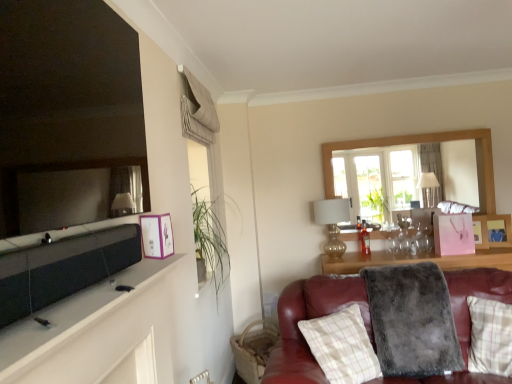
Describe the element at coordinates (253, 350) in the screenshot. I see `brown woven basket at lower right` at that location.

Measure the distance between purple paper picture frame at upper left, which appears as the first picture frame when viewed from the left, and camera.

purple paper picture frame at upper left, which appears as the first picture frame when viewed from the left, is 1.58 meters away from camera.

What is the approximate width of gray fluffy blanket at lower right?

28.97 inches.

Describe the element at coordinates (425, 142) in the screenshot. I see `wooden frame window at upper right` at that location.

Image resolution: width=512 pixels, height=384 pixels. What are the coordinates of `brown woven basket at lower right` in the screenshot? It's located at 253,350.

Considering the sizes of matte black tv at upper left and gray fluffy blanket at lower right in the image, is matte black tv at upper left bigger or smaller than gray fluffy blanket at lower right?

matte black tv at upper left is smaller than gray fluffy blanket at lower right.

Is matte black tv at upper left directly adjacent to gray fluffy blanket at lower right?

No, matte black tv at upper left is not beside gray fluffy blanket at lower right.

Looking at this image, in terms of width, does matte black tv at upper left look wider or thinner when compared to gray fluffy blanket at lower right?

Clearly, matte black tv at upper left has less width compared to gray fluffy blanket at lower right.

Is gray fluffy blanket at lower right at the back of matte black tv at upper left?

No, matte black tv at upper left is not facing away from gray fluffy blanket at lower right.

Where is `the 1st picture frame counting from the right side of the matte black mirror at upper left`? the 1st picture frame counting from the right side of the matte black mirror at upper left is located at coordinates tap(157, 236).

Between purple paper picture frame at upper left, which appears as the first picture frame when viewed from the left, and matte black mirror at upper left, which one appears on the left side from the viewer's perspective?

matte black mirror at upper left is more to the left.

How many degrees apart are the facing directions of purple paper picture frame at upper left, which appears as the second picture frame when viewed from the right, and matte black mirror at upper left?

There is a 0.00555-degree angle between the facing directions of purple paper picture frame at upper left, which appears as the second picture frame when viewed from the right, and matte black mirror at upper left.

From the image's perspective, between purple paper picture frame at upper left, which ranks as the second picture frame in back-to-front order, and matte black mirror at upper left, which one is located above?

matte black mirror at upper left is shown above in the image.

Is gold metallic lamp at upper right not near gray fluffy blanket at lower right?

Yes, gold metallic lamp at upper right and gray fluffy blanket at lower right are quite far apart.

Where is `lamp above the gray fluffy blanket at lower right (from a real-world perspective)`? The height and width of the screenshot is (384, 512). lamp above the gray fluffy blanket at lower right (from a real-world perspective) is located at coordinates (332, 223).

Which of these two, gold metallic lamp at upper right or gray fluffy blanket at lower right, stands shorter?

With less height is gold metallic lamp at upper right.

How different are the orientations of gold metallic lamp at upper right and gray fluffy blanket at lower right in degrees?

gold metallic lamp at upper right and gray fluffy blanket at lower right are facing 2.39 degrees away from each other.

Considering the sizes of objects plaid fabric pillow at lower right, the second pillow positioned from the left, and wooden photo frame at upper right, which is counted as the first picture frame, starting from the back, in the image provided, who is smaller, plaid fabric pillow at lower right, the second pillow positioned from the left, or wooden photo frame at upper right, which is counted as the first picture frame, starting from the back,?

wooden photo frame at upper right, which is counted as the first picture frame, starting from the back.

Looking at their sizes, would you say plaid fabric pillow at lower right, the second pillow positioned from the left, is wider or thinner than wooden photo frame at upper right, which is counted as the first picture frame, starting from the back?

Clearly, plaid fabric pillow at lower right, the second pillow positioned from the left, has more width compared to wooden photo frame at upper right, which is counted as the first picture frame, starting from the back.

Could you measure the distance between plaid fabric pillow at lower right, acting as the first pillow starting from the right, and wooden photo frame at upper right, marked as the first picture frame in a right-to-left arrangement?

4.65 feet.

Is wooden photo frame at upper right, marked as the first picture frame in a right-to-left arrangement, at the back of plaid fabric pillow at lower right, the second pillow positioned from the left?

plaid fabric pillow at lower right, the second pillow positioned from the left, is not turned away from wooden photo frame at upper right, marked as the first picture frame in a right-to-left arrangement.

From a real-world perspective, is gold metallic lamp at upper right over matte black tv at upper left?

No, from a real-world perspective, gold metallic lamp at upper right is not above matte black tv at upper left.

Is gold metallic lamp at upper right bigger or smaller than matte black tv at upper left?

gold metallic lamp at upper right is bigger than matte black tv at upper left.

In the scene shown: Can you confirm if gold metallic lamp at upper right is wider than matte black tv at upper left?

Correct, the width of gold metallic lamp at upper right exceeds that of matte black tv at upper left.

How distant is gold metallic lamp at upper right from matte black tv at upper left?

The distance of gold metallic lamp at upper right from matte black tv at upper left is 8.15 feet.

Which is closer, (x=477, y=171) or (x=129, y=129)?

Point (x=129, y=129)

Relative to matte black mirror at upper left, is wooden frame window at upper right in front or behind?

Visually, wooden frame window at upper right is located behind matte black mirror at upper left.

Based on the photo, is wooden frame window at upper right wider than matte black mirror at upper left?

Yes, wooden frame window at upper right is wider than matte black mirror at upper left.

Considering the relative sizes of wooden frame window at upper right and matte black mirror at upper left in the image provided, is wooden frame window at upper right taller than matte black mirror at upper left?

Indeed, wooden frame window at upper right has a greater height compared to matte black mirror at upper left.

From a real-world perspective, does matte black mirror at upper left stand above brown woven basket at lower right?

Yes.

Would you say matte black mirror at upper left is outside brown woven basket at lower right?

Indeed, matte black mirror at upper left is completely outside brown woven basket at lower right.

Is brown woven basket at lower right at the back of matte black mirror at upper left?

No, matte black mirror at upper left is not facing away from brown woven basket at lower right.

What are the coordinates of `mirror in front of the brown woven basket at lower right` in the screenshot? It's located at (66, 94).

At what (x,y) coordinates should I click in order to perform the action: click on mantle above the gray fluffy blanket at lower right (from the image's perspective). Please return your answer as a coordinate pair (x, y). This screenshot has height=384, width=512. Looking at the image, I should click on (98, 334).

At what (x,y) coordinates should I click in order to perform the action: click on the 1st picture frame positioned below the matte black mirror at upper left (from a real-world perspective). Please return your answer as a coordinate pair (x, y). Image resolution: width=512 pixels, height=384 pixels. Looking at the image, I should click on point(157,236).

When comparing their distances from wooden photo frame at upper right, the second picture frame in the front-to-back sequence, does gray fluffy blanket at lower right or gold metallic lamp at upper right seem further?

gray fluffy blanket at lower right is positioned further to the anchor wooden photo frame at upper right, the second picture frame in the front-to-back sequence.

Looking at the image, which one is located further to wooden frame window at upper right, gold metallic lamp at upper right or brown woven basket at lower right?

Based on the image, brown woven basket at lower right appears to be further to wooden frame window at upper right.

Considering their positions, is brown woven basket at lower right positioned further to purple paper picture frame at upper left, which appears as the second picture frame when viewed from the right, than matte black tv at upper left?

brown woven basket at lower right is positioned further to the anchor purple paper picture frame at upper left, which appears as the second picture frame when viewed from the right.

Based on their spatial positions, is gold metallic lamp at upper right or matte black tv at upper left further from plaid fabric pillow at lower right, the 2th pillow viewed from the right?

The object further to plaid fabric pillow at lower right, the 2th pillow viewed from the right, is gold metallic lamp at upper right.

From the image, which object appears to be nearer to matte black tv at upper left, purple paper picture frame at upper left, which appears as the first picture frame when viewed from the left, or matte black mirror at upper left?

The object closer to matte black tv at upper left is purple paper picture frame at upper left, which appears as the first picture frame when viewed from the left.

Estimate the real-world distances between objects in this image. Which object is closer to matte black tv at upper left, wooden photo frame at upper right, marked as the first picture frame in a right-to-left arrangement, or plaid fabric pillow at lower right, which is the first pillow in left-to-right order?

Based on the image, plaid fabric pillow at lower right, which is the first pillow in left-to-right order, appears to be nearer to matte black tv at upper left.

Considering their positions, is plaid fabric pillow at lower right, acting as the first pillow starting from the right, positioned further to matte black mirror at upper left than matte black tv at upper left?

Among the two, plaid fabric pillow at lower right, acting as the first pillow starting from the right, is located further to matte black mirror at upper left.

Which object lies nearer to the anchor point matte black tv at upper left, plaid fabric pillow at lower right, acting as the first pillow starting from the right, or plaid fabric pillow at lower right, the 2th pillow viewed from the right?

Among the two, plaid fabric pillow at lower right, the 2th pillow viewed from the right, is located nearer to matte black tv at upper left.

You are a GUI agent. You are given a task and a screenshot of the screen. Output one action in this format:
    pyautogui.click(x=<x>, y=<y>)
    Task: Click on the blanket between brown woven basket at lower right and plaid fabric pillow at lower right, acting as the first pillow starting from the right, in the horizontal direction
    This screenshot has width=512, height=384.
    Given the screenshot: What is the action you would take?
    pyautogui.click(x=412, y=320)

Locate an element on the screen. This screenshot has height=384, width=512. mirror positioned between matte black tv at upper left and plaid fabric pillow at lower right, which is the first pillow in left-to-right order, from near to far is located at coordinates (66, 94).

Find the location of a particular element. The width and height of the screenshot is (512, 384). blanket between plaid fabric pillow at lower right, the 2th pillow viewed from the right, and plaid fabric pillow at lower right, acting as the first pillow starting from the right is located at coordinates (412, 320).

Where is `mirror between matte black tv at upper left and gray fluffy blanket at lower right in the front-back direction`? This screenshot has width=512, height=384. mirror between matte black tv at upper left and gray fluffy blanket at lower right in the front-back direction is located at coordinates (66, 94).